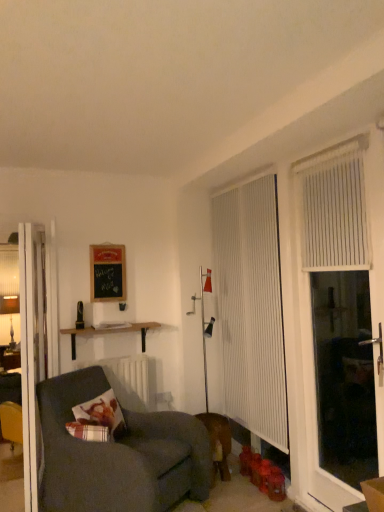
Describe the element at coordinates (312, 318) in the screenshot. Image resolution: width=384 pixels, height=512 pixels. I see `white vertical blinds at right` at that location.

This screenshot has height=512, width=384. What do you see at coordinates (334, 208) in the screenshot?
I see `white vertical blinds at right, the 2th curtain viewed from the left` at bounding box center [334, 208].

Measure the distance between black chalkboard at upper left and camera.

They are 3.57 meters apart.

Locate an element on the screen. black chalkboard at upper left is located at coordinates (107, 273).

The height and width of the screenshot is (512, 384). What do you see at coordinates (251, 308) in the screenshot?
I see `white vertical blinds at right, which is the second curtain in front-to-back order` at bounding box center [251, 308].

Describe the element at coordinates (218, 442) in the screenshot. I see `brown leather dog at lower center` at that location.

Locate an element on the screen. This screenshot has width=384, height=512. plaid fabric pillow at lower left is located at coordinates (98, 419).

Find the location of a particular element. The image size is (384, 512). white vertical blinds at right is located at coordinates (312, 318).

Is the position of white vertical blinds at right, which is the second curtain in front-to-back order, less distant than that of plaid fabric pillow at lower left?

That is False.

From the image's perspective, is white vertical blinds at right, which is the second curtain in front-to-back order, located above or below plaid fabric pillow at lower left?

white vertical blinds at right, which is the second curtain in front-to-back order, is situated higher than plaid fabric pillow at lower left in the image.

From a real-world perspective, is white vertical blinds at right, which is the second curtain in front-to-back order, located higher than plaid fabric pillow at lower left?

Yes.

Is black chalkboard at upper left further to camera compared to brown leather dog at lower center?

Yes, black chalkboard at upper left is further from the viewer.

Is point (122, 266) positioned in front of point (214, 416)?

No, it is behind (214, 416).

Is black chalkboard at upper left in contact with brown leather dog at lower center?

No, black chalkboard at upper left is not making contact with brown leather dog at lower center.

In the scene shown: Is white vertical blinds at right, which appears as the second curtain when viewed from the back, touching wooden shelf at upper left?

No, white vertical blinds at right, which appears as the second curtain when viewed from the back, is not in contact with wooden shelf at upper left.

Does white vertical blinds at right, the 1th curtain viewed from the front, come behind wooden shelf at upper left?

No, white vertical blinds at right, the 1th curtain viewed from the front, is closer to the viewer.

Would you say white vertical blinds at right, positioned as the 1th curtain in right-to-left order, is to the left or to the right of wooden shelf at upper left in the picture?

white vertical blinds at right, positioned as the 1th curtain in right-to-left order, is positioned on wooden shelf at upper left's right side.

Could wooden shelf at upper left be considered to be inside white vertical blinds at right, the 1th curtain viewed from the front?

No, wooden shelf at upper left is not surrounded by white vertical blinds at right, the 1th curtain viewed from the front.

Which is behind, white vertical blinds at right or plaid fabric pillow at lower left?

plaid fabric pillow at lower left is further away from the camera.

From the image's perspective, is white vertical blinds at right located above plaid fabric pillow at lower left?

Yes, from the image's perspective, white vertical blinds at right is above plaid fabric pillow at lower left.

Consider the image. Is white vertical blinds at right positioned with its back to plaid fabric pillow at lower left?

No, white vertical blinds at right's orientation is not away from plaid fabric pillow at lower left.

From a real-world perspective, which is physically below, white vertical blinds at right or plaid fabric pillow at lower left?

plaid fabric pillow at lower left.

From the image's perspective, which is below, plaid fabric pillow at lower left or brown leather dog at lower center?

brown leather dog at lower center is shown below in the image.

Can you confirm if plaid fabric pillow at lower left is thinner than brown leather dog at lower center?

Indeed, plaid fabric pillow at lower left has a lesser width compared to brown leather dog at lower center.

Is the depth of plaid fabric pillow at lower left less than that of brown leather dog at lower center?

Yes, plaid fabric pillow at lower left is in front of brown leather dog at lower center.

Which is behind, wooden shelf at upper left or black chalkboard at upper left?

black chalkboard at upper left is further away from the camera.

Does point (154, 322) appear closer or farther from the camera than point (121, 286)?

Point (154, 322) is farther from the camera than point (121, 286).

In order to click on bulletin board on the left of wooden shelf at upper left in this screenshot , I will do `click(107, 273)`.

Considering the sizes of objects wooden shelf at upper left and black chalkboard at upper left in the image provided, who is taller, wooden shelf at upper left or black chalkboard at upper left?

black chalkboard at upper left is taller.

From a real-world perspective, is brown leather dog at lower center above or below black chalkboard at upper left?

brown leather dog at lower center is below black chalkboard at upper left.

Is the surface of brown leather dog at lower center in direct contact with black chalkboard at upper left?

No.

Which is behind, brown leather dog at lower center or black chalkboard at upper left?

black chalkboard at upper left is more distant.

Which point is more distant from viewer, (214,477) or (96,291)?

Point (96,291)

Where is `curtain behind the plaid fabric pillow at lower left`? The width and height of the screenshot is (384, 512). curtain behind the plaid fabric pillow at lower left is located at coordinates (251, 308).

This screenshot has height=512, width=384. I want to click on animal that appears on the right of black chalkboard at upper left, so click(x=218, y=442).

Considering their positions, is black chalkboard at upper left positioned closer to brown leather dog at lower center than white vertical blinds at right, the 1th curtain viewed from the front?

The object closer to brown leather dog at lower center is black chalkboard at upper left.

Based on their spatial positions, is dark gray fabric couch at lower left or wooden shelf at upper left further from white glossy door at left?

wooden shelf at upper left is positioned further to the anchor white glossy door at left.

From the image, which object appears to be nearer to brown leather dog at lower center, white vertical blinds at right or plaid fabric pillow at lower left?

plaid fabric pillow at lower left lies closer to brown leather dog at lower center than the other object.

When comparing their distances from brown leather dog at lower center, does plaid fabric pillow at lower left or black chalkboard at upper left seem further?

black chalkboard at upper left lies further to brown leather dog at lower center than the other object.

Considering their positions, is white vertical blinds at right, positioned as the 1th curtain in back-to-front order, positioned further to white glossy door at left than white vertical blinds at right?

white vertical blinds at right lies further to white glossy door at left than the other object.

Which object lies further to the anchor point plaid fabric pillow at lower left, wooden shelf at upper left or brown leather dog at lower center?

Among the two, brown leather dog at lower center is located further to plaid fabric pillow at lower left.

Estimate the real-world distances between objects in this image. Which object is further from white vertical blinds at right, the 1th curtain viewed from the front, brown leather dog at lower center or black chalkboard at upper left?

The object further to white vertical blinds at right, the 1th curtain viewed from the front, is black chalkboard at upper left.

In the scene shown: Which object lies nearer to the anchor point wooden shelf at upper left, white vertical blinds at right, which ranks as the second curtain in right-to-left order, or white glossy door at left?

white glossy door at left lies closer to wooden shelf at upper left than the other object.

Where is `pillow between wooden shelf at upper left and white vertical blinds at right, positioned as the 1th curtain in back-to-front order`? pillow between wooden shelf at upper left and white vertical blinds at right, positioned as the 1th curtain in back-to-front order is located at coordinates [x=98, y=419].

What are the coordinates of `curtain between white vertical blinds at right and brown leather dog at lower center in the up-down direction` in the screenshot? It's located at (251, 308).

Locate an element on the screen. The width and height of the screenshot is (384, 512). pillow between black chalkboard at upper left and brown leather dog at lower center in the up-down direction is located at coordinates (98, 419).

The width and height of the screenshot is (384, 512). Find the location of `animal between dark gray fabric couch at lower left and wooden shelf at upper left from front to back`. animal between dark gray fabric couch at lower left and wooden shelf at upper left from front to back is located at coordinates (218, 442).